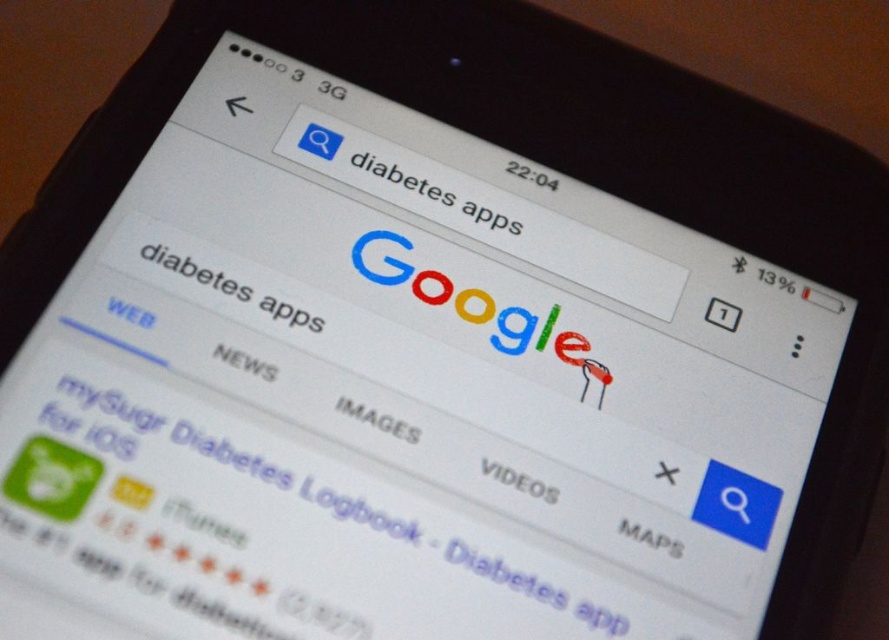
You are a GUI agent. You are given a task and a screenshot of the screen. Output one action in this format:
    pyautogui.click(x=<x>, y=<y>)
    Task: Click on the green glossy app icon at lower left
    The width and height of the screenshot is (889, 640).
    Given the screenshot: What is the action you would take?
    pyautogui.click(x=298, y=532)

From the picture: Who is shorter, green glossy app icon at lower left or white text at center?

Standing shorter between the two is white text at center.

Find the location of a particular element. The image size is (889, 640). green glossy app icon at lower left is located at coordinates (298, 532).

At what (x,y) coordinates should I click in order to perform the action: click on green glossy app icon at lower left. Please return your answer as a coordinate pair (x, y). Looking at the image, I should click on (298, 532).